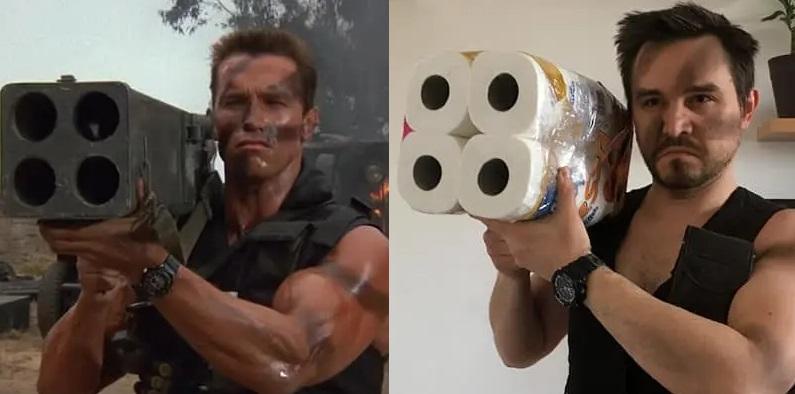
At what (x,y) coordinates should I click in order to perform the action: click on paper towel roll. Please return your answer as a coordinate pair (x, y). The height and width of the screenshot is (394, 795). Looking at the image, I should click on (444, 197), (471, 161), (483, 118), (440, 71).